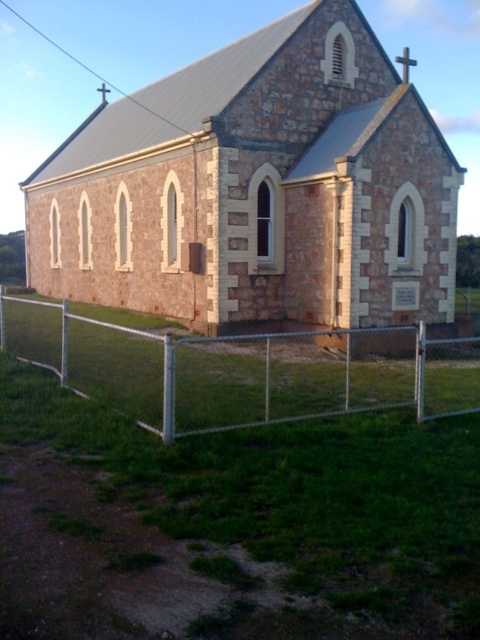
Can you confirm if stone church at center is positioned to the right of metal chain-link fence at lower center?

Yes, stone church at center is to the right of metal chain-link fence at lower center.

Between point (349, 118) and point (394, 384), which one is positioned in front?

Positioned in front is point (394, 384).

Locate an element on the screen. The image size is (480, 640). stone church at center is located at coordinates (257, 188).